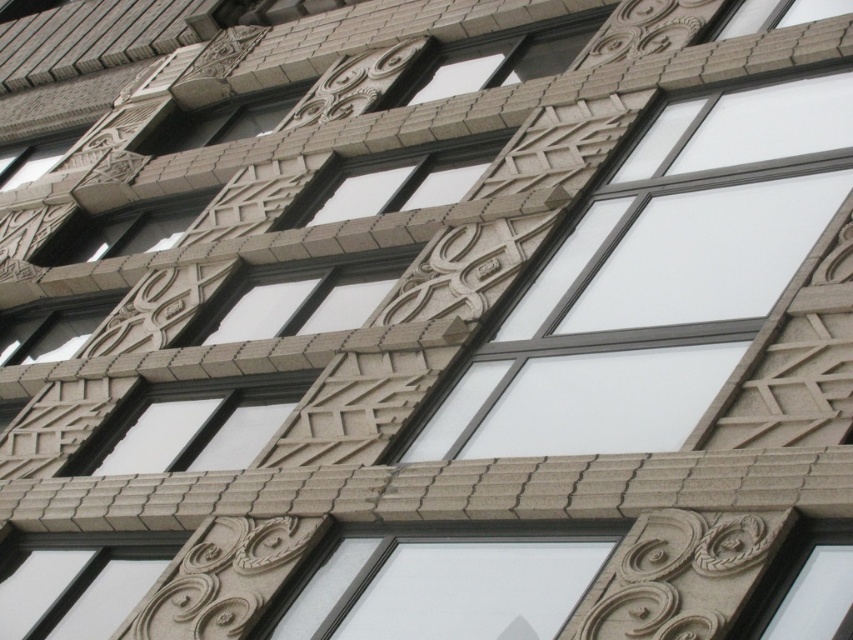
You are an architect analyzing the building facade. You notice a point at coordinates (399, 180). What architectural feature is located at this point?

The point at coordinates (399, 180) indicates a smooth gray stone window at center.